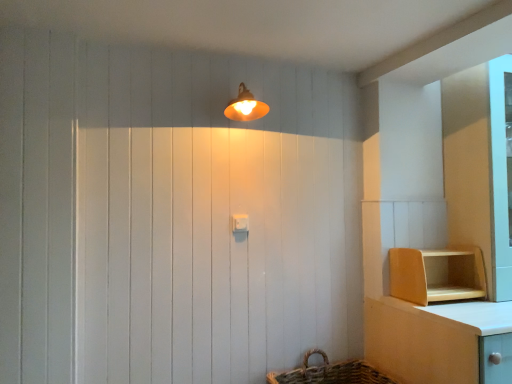
Question: Considering the positions of matte orange lampshade at upper center and wooden shelf at lower right in the image, is matte orange lampshade at upper center wider or thinner than wooden shelf at lower right?

Choices:
 (A) thin
 (B) wide

Answer: (A)

Question: From a real-world perspective, relative to wooden shelf at lower right, is matte orange lampshade at upper center vertically above or below?

Choices:
 (A) above
 (B) below

Answer: (A)

Question: Considering the real-world distances, which object is farthest from the wooden shelf at lower right?

Choices:
 (A) matte orange lampshade at upper center
 (B) white plastic light switch at center

Answer: (A)

Question: Estimate the real-world distances between objects in this image. Which object is closer to the white plastic light switch at center?

Choices:
 (A) matte orange lampshade at upper center
 (B) wooden shelf at lower right

Answer: (A)